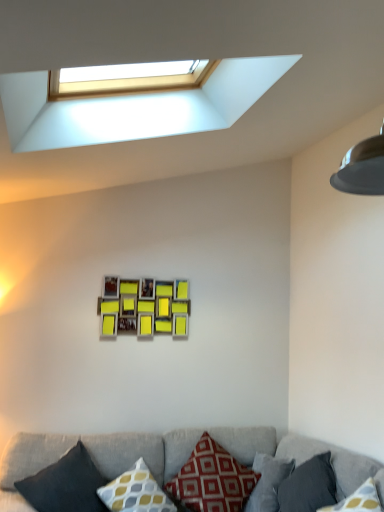
Question: Is dark gray fabric pillow at lower left, which ranks as the 5th pillow in right-to-left order, completely or partially inside textured gray couch at lower center?

Choices:
 (A) yes
 (B) no

Answer: (A)

Question: Is textured gray couch at lower center to the left of dark gray fabric pillow at lower left, which ranks as the 5th pillow in right-to-left order, from the viewer's perspective?

Choices:
 (A) yes
 (B) no

Answer: (B)

Question: Is textured gray couch at lower center oriented towards dark gray fabric pillow at lower left, the 1th pillow from the left?

Choices:
 (A) yes
 (B) no

Answer: (A)

Question: Is textured gray couch at lower center facing away from dark gray fabric pillow at lower left, the 1th pillow from the left?

Choices:
 (A) yes
 (B) no

Answer: (B)

Question: Are textured gray couch at lower center and dark gray fabric pillow at lower left, which ranks as the 5th pillow in right-to-left order, far apart?

Choices:
 (A) no
 (B) yes

Answer: (A)

Question: Choose the correct answer: Is dark gray fabric pillow at lower right, which ranks as the 1th pillow in right-to-left order, inside wooden photo frame at center or outside it?

Choices:
 (A) outside
 (B) inside

Answer: (A)

Question: In the image, is dark gray fabric pillow at lower right, which ranks as the 1th pillow in right-to-left order, positioned in front of or behind wooden photo frame at center?

Choices:
 (A) behind
 (B) front

Answer: (B)

Question: From the image's perspective, is dark gray fabric pillow at lower right, arranged as the 5th pillow when viewed from the left, positioned above or below wooden photo frame at center?

Choices:
 (A) above
 (B) below

Answer: (B)

Question: Is dark gray fabric pillow at lower right, which ranks as the 1th pillow in right-to-left order, to the left or to the right of wooden photo frame at center in the image?

Choices:
 (A) right
 (B) left

Answer: (A)

Question: From the image's perspective, is textured gray couch at lower center above or below dark gray fabric pillow at lower left, which ranks as the 5th pillow in right-to-left order?

Choices:
 (A) below
 (B) above

Answer: (A)

Question: Is point (291, 455) closer or farther from the camera than point (38, 480)?

Choices:
 (A) farther
 (B) closer

Answer: (A)

Question: Would you say textured gray couch at lower center is to the left or to the right of dark gray fabric pillow at lower left, the 1th pillow from the left, in the picture?

Choices:
 (A) right
 (B) left

Answer: (A)

Question: Considering the positions of textured gray couch at lower center and dark gray fabric pillow at lower left, the 1th pillow from the left, in the image, is textured gray couch at lower center wider or thinner than dark gray fabric pillow at lower left, the 1th pillow from the left,?

Choices:
 (A) thin
 (B) wide

Answer: (B)

Question: Considering the relative positions of yellow and gray patterned pillow at center, which ranks as the 2th pillow in left-to-right order, and wooden photo frame at center in the image provided, is yellow and gray patterned pillow at center, which ranks as the 2th pillow in left-to-right order, to the left or to the right of wooden photo frame at center?

Choices:
 (A) right
 (B) left

Answer: (A)

Question: Relative to wooden photo frame at center, is yellow and gray patterned pillow at center, which ranks as the 2th pillow in left-to-right order, in front or behind?

Choices:
 (A) behind
 (B) front

Answer: (B)